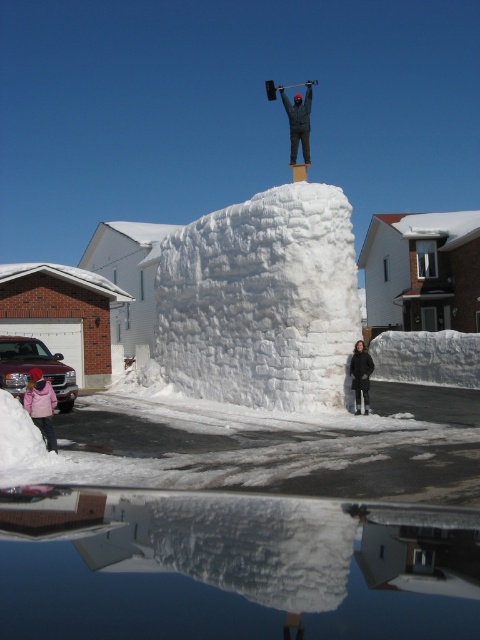
Question: Which point is farther to the camera?

Choices:
 (A) (356, 380)
 (B) (307, 157)

Answer: (B)

Question: Does matte pink jacket at lower left have a lesser width compared to black matte jacket at lower center?

Choices:
 (A) no
 (B) yes

Answer: (A)

Question: Which object appears farthest from the camera in this image?

Choices:
 (A) dark gray fabric at upper center
 (B) black matte jacket at lower center
 (C) matte pink jacket at lower left

Answer: (A)

Question: Is dark gray fabric at upper center bigger than black matte jacket at lower center?

Choices:
 (A) no
 (B) yes

Answer: (B)

Question: Which of these objects is positioned closest to the dark gray fabric at upper center?

Choices:
 (A) black matte jacket at lower center
 (B) matte pink jacket at lower left

Answer: (A)

Question: Is dark gray fabric at upper center positioned at the back of black matte jacket at lower center?

Choices:
 (A) no
 (B) yes

Answer: (B)